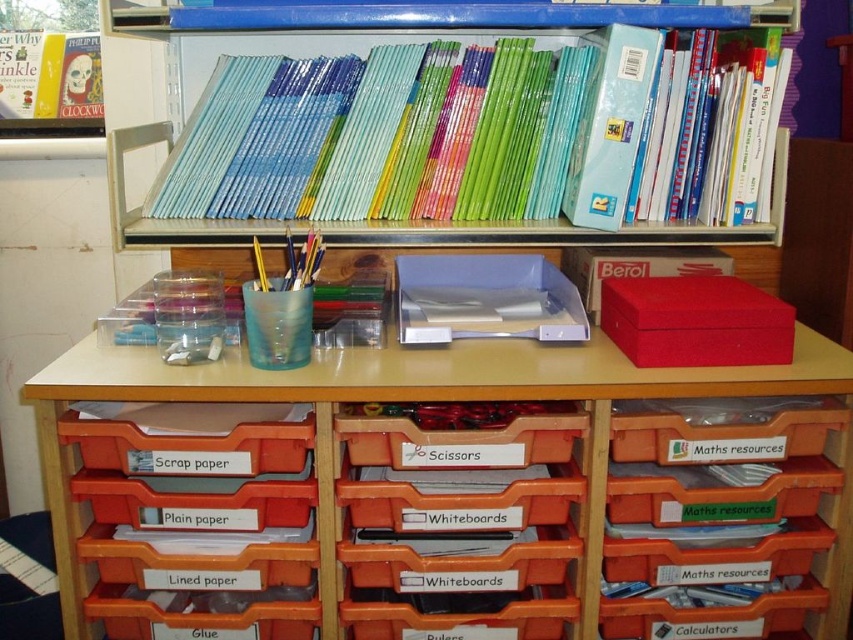
Can you confirm if blue plastic books at upper center is thinner than matte plastic table at center?

Yes, blue plastic books at upper center is thinner than matte plastic table at center.

The image size is (853, 640). What are the coordinates of `blue plastic books at upper center` in the screenshot? It's located at (473, 140).

Between blue plastic books at upper center and orange plastic tray at lower left, which one has more height?

With more height is blue plastic books at upper center.

This screenshot has width=853, height=640. Find the location of `blue plastic books at upper center`. blue plastic books at upper center is located at coordinates (473, 140).

Does point (132, 243) lie behind point (187, 637)?

Yes, it is behind point (187, 637).

The height and width of the screenshot is (640, 853). Find the location of `blue plastic books at upper center`. blue plastic books at upper center is located at coordinates (473, 140).

Who is more forward, (x=273, y=552) or (x=749, y=464)?

Point (x=273, y=552)

Is orange plastic tray at lower left wider than translucent plastic tray at lower right?

Correct, the width of orange plastic tray at lower left exceeds that of translucent plastic tray at lower right.

Image resolution: width=853 pixels, height=640 pixels. Describe the element at coordinates (195, 518) in the screenshot. I see `orange plastic tray at lower left` at that location.

The width and height of the screenshot is (853, 640). In order to click on orange plastic tray at lower left in this screenshot , I will do `click(195, 518)`.